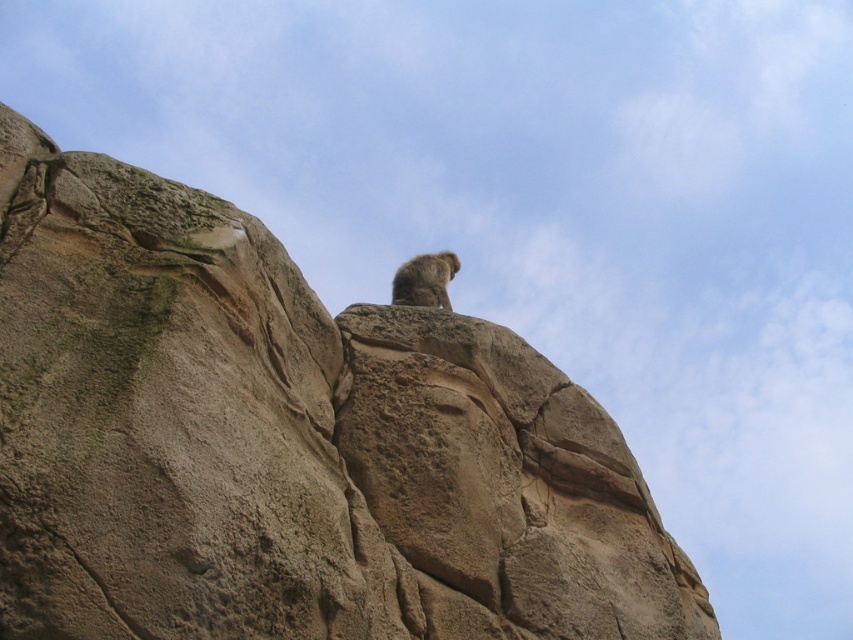
Is point (109, 196) farther from camera compared to point (428, 305)?

No, it is in front of (428, 305).

Which of these two, brown rough rock at upper center or grayish-brown fur monkey at upper center, stands taller?

With more height is brown rough rock at upper center.

Who is more distant from viewer, (91,416) or (401,280)?

Point (401,280)

The image size is (853, 640). Identify the location of brown rough rock at upper center. (286, 444).